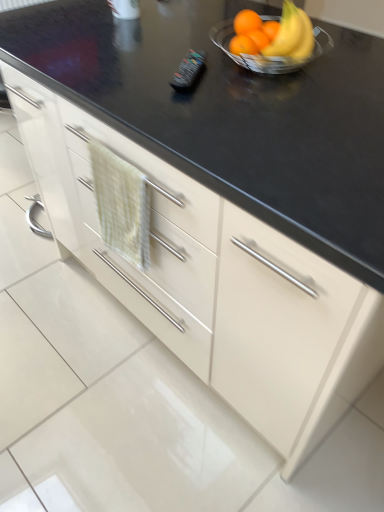
You are a GUI agent. You are given a task and a screenshot of the screen. Output one action in this format:
    pyautogui.click(x=<x>, y=<y>)
    Task: Click on the free space above clear glass bowl at upper right (from a real-world perspective)
    The width and height of the screenshot is (384, 512).
    Given the screenshot: What is the action you would take?
    pyautogui.click(x=273, y=28)